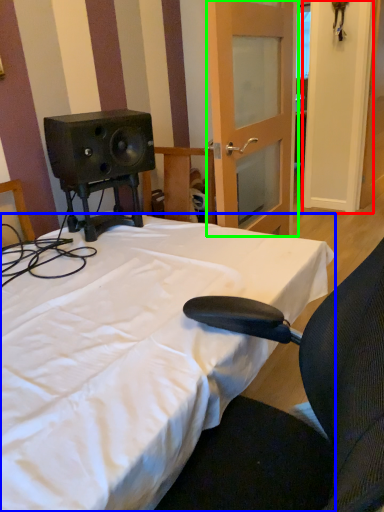
Question: Which object is positioned closest to door (highlighted by a red box)? Select from bed (highlighted by a blue box) and door (highlighted by a green box).

Choices:
 (A) bed
 (B) door

Answer: (B)